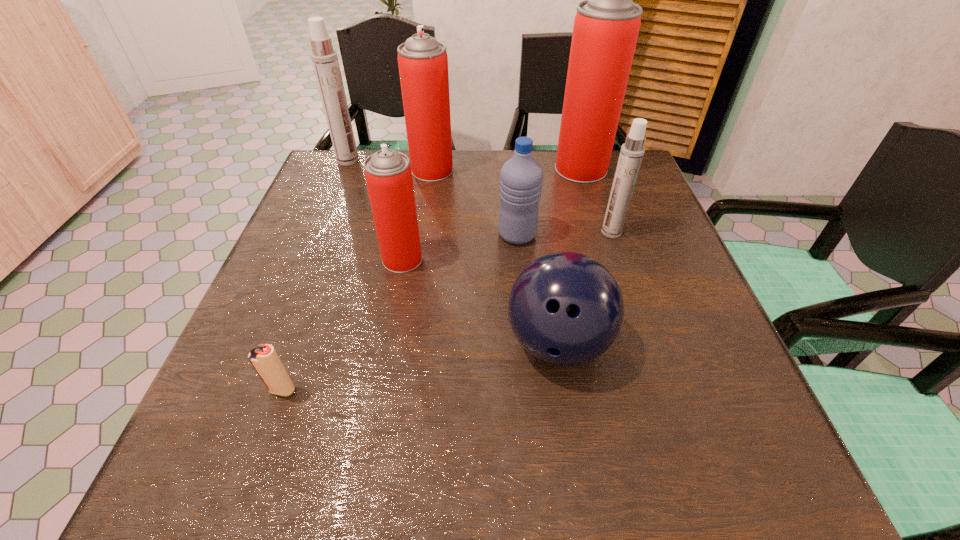
Locate an element on the screen. Image resolution: width=960 pixels, height=540 pixels. the tallest object is located at coordinates (606, 26).

Where is `the biggest red aerosol can`? the biggest red aerosol can is located at coordinates (606, 26).

Locate an element on the screen. The height and width of the screenshot is (540, 960). the second biggest red aerosol can is located at coordinates point(422,60).

Find the location of `the farther white aerosol can`. the farther white aerosol can is located at coordinates (325, 61).

The height and width of the screenshot is (540, 960). What are the coordinates of `the left white aerosol can` in the screenshot? It's located at (325, 61).

In order to click on the nearest aerosol can in this screenshot , I will do `click(388, 174)`.

This screenshot has width=960, height=540. In order to click on the smallest red aerosol can in this screenshot , I will do `click(388, 174)`.

This screenshot has height=540, width=960. In order to click on the smaller white aerosol can in this screenshot , I will do `click(632, 151)`.

Where is `the nearer white aerosol can`? the nearer white aerosol can is located at coordinates (632, 151).

You are a GUI agent. You are given a task and a screenshot of the screen. Output one action in this format:
    pyautogui.click(x=<x>, y=<y>)
    Task: Click on the blue water bottle
    
    Given the screenshot: What is the action you would take?
    pyautogui.click(x=521, y=177)